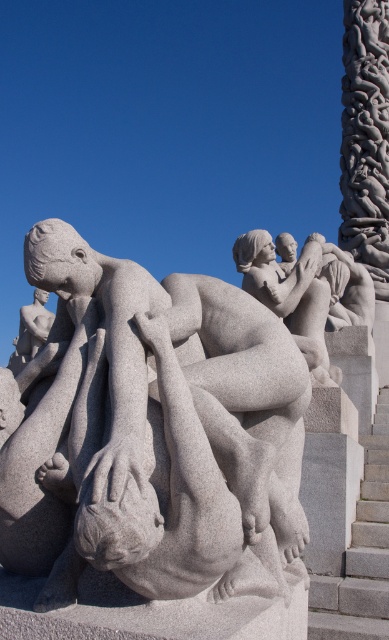
You are standing at a point 18.12 meters away from the point labeled as point (x=276, y=522) in the sculpture. If you want to move closer to the sculpture, which direction should you walk?

You should walk towards the sculpture to reduce the distance between you and point (x=276, y=522).

You are an architect assessing the spatial compatibility of the gray granite sculpture at center and the gray stone stairs at right for a new public plaza. Given their heights, which object would require more vertical clearance in the design plans?

The gray granite sculpture at center requires more vertical clearance because it has a greater height than the gray stone stairs at right.